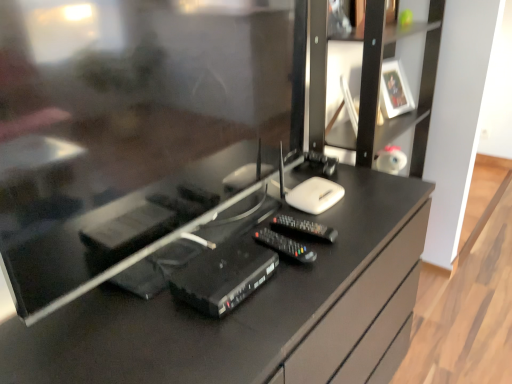
Find the location of a particular element. The width and height of the screenshot is (512, 384). vacant space in front of black plastic remote control at center, the 2th equipment positioned from the left is located at coordinates (286, 295).